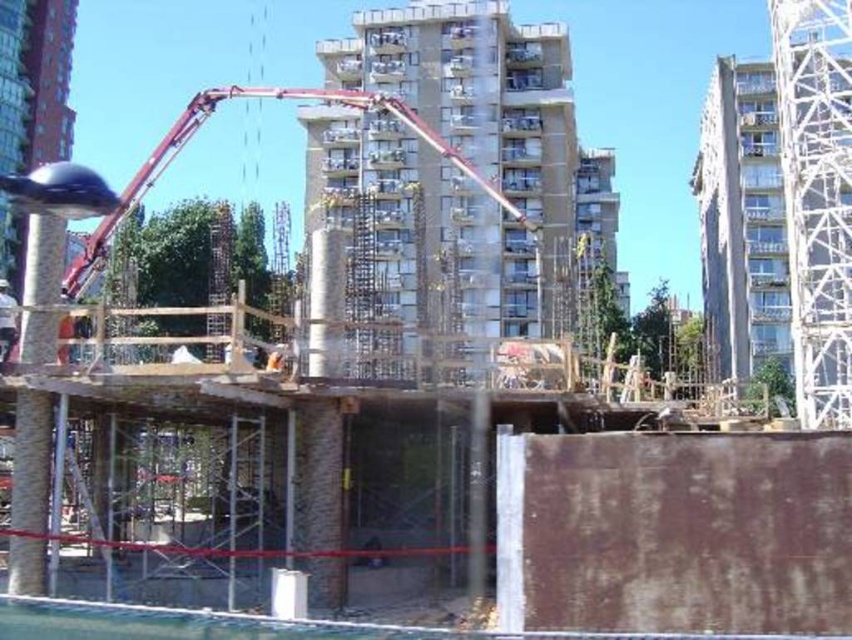
Question: Considering the relative positions of smooth concrete building at right and metallic red crane at center in the image provided, where is smooth concrete building at right located with respect to metallic red crane at center?

Choices:
 (A) right
 (B) left

Answer: (A)

Question: Which point appears farthest from the camera in this image?

Choices:
 (A) [x=9, y=296]
 (B) [x=366, y=129]
 (C) [x=773, y=60]

Answer: (B)

Question: Which object appears farthest from the camera in this image?

Choices:
 (A) light brown wooden construction worker at lower left
 (B) smooth concrete building at right
 (C) concrete/rough concrete building at center

Answer: (B)

Question: Which object appears closest to the camera in this image?

Choices:
 (A) white metallic tower at upper right
 (B) light brown wooden construction worker at lower left
 (C) concrete/rough concrete building at center

Answer: (B)

Question: Is metallic red crane at center positioned in front of light brown wooden construction worker at lower left?

Choices:
 (A) yes
 (B) no

Answer: (B)

Question: Can you confirm if concrete/rough concrete building at center is positioned to the left of metallic red crane at center?

Choices:
 (A) yes
 (B) no

Answer: (B)